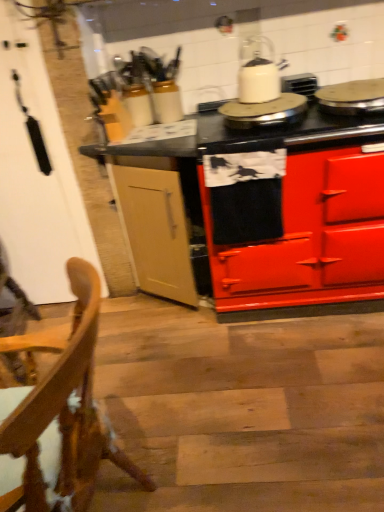
Question: From the image's perspective, would you say metallic silver pan at upper right, which ranks as the first appliance in right-to-left order, is positioned over wooden chair at lower left?

Choices:
 (A) yes
 (B) no

Answer: (A)

Question: Is metallic silver pan at upper right, which ranks as the first appliance in right-to-left order, facing away from wooden chair at lower left?

Choices:
 (A) no
 (B) yes

Answer: (A)

Question: Is metallic silver pan at upper right, which ranks as the first appliance in right-to-left order, aimed at wooden chair at lower left?

Choices:
 (A) yes
 (B) no

Answer: (B)

Question: From a real-world perspective, is metallic silver pan at upper right, placed as the 2th appliance when sorted from left to right, physically below wooden chair at lower left?

Choices:
 (A) no
 (B) yes

Answer: (A)

Question: Is metallic silver pan at upper right, placed as the 2th appliance when sorted from left to right, shorter than wooden chair at lower left?

Choices:
 (A) no
 (B) yes

Answer: (B)

Question: In terms of width, does white glossy kettle at upper center look wider or thinner when compared to red glossy stove at center?

Choices:
 (A) thin
 (B) wide

Answer: (A)

Question: From the image's perspective, is white glossy kettle at upper center located above or below red glossy stove at center?

Choices:
 (A) above
 (B) below

Answer: (A)

Question: Which is correct: white glossy kettle at upper center is inside red glossy stove at center, or outside of it?

Choices:
 (A) inside
 (B) outside

Answer: (B)

Question: In the image, is white glossy kettle at upper center positioned in front of or behind red glossy stove at center?

Choices:
 (A) behind
 (B) front

Answer: (A)

Question: Is metallic silver pan at upper right, placed as the 2th appliance when sorted from left to right, wider or thinner than wooden chair at lower left?

Choices:
 (A) thin
 (B) wide

Answer: (A)

Question: Is metallic silver pan at upper right, which ranks as the first appliance in right-to-left order, in front of or behind wooden chair at lower left in the image?

Choices:
 (A) behind
 (B) front

Answer: (A)

Question: Considering the positions of metallic silver pan at upper right, placed as the 2th appliance when sorted from left to right, and wooden chair at lower left in the image, is metallic silver pan at upper right, placed as the 2th appliance when sorted from left to right, taller or shorter than wooden chair at lower left?

Choices:
 (A) tall
 (B) short

Answer: (B)

Question: In terms of size, does metallic silver pan at upper right, which ranks as the first appliance in right-to-left order, appear bigger or smaller than wooden chair at lower left?

Choices:
 (A) small
 (B) big

Answer: (A)

Question: Is white glossy kettle at upper center, acting as the 2th appliance starting from the right, wider or thinner than white glossy kettle at upper center?

Choices:
 (A) wide
 (B) thin

Answer: (A)

Question: Is white glossy kettle at upper center, acting as the 2th appliance starting from the right, in front of or behind white glossy kettle at upper center in the image?

Choices:
 (A) front
 (B) behind

Answer: (A)